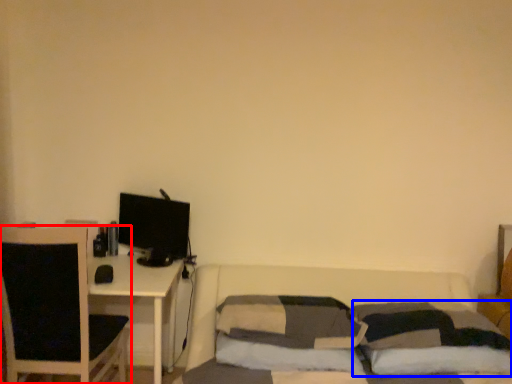
Question: Among these objects, which one is nearest to the camera, chair (highlighted by a red box) or pillow (highlighted by a blue box)?

Choices:
 (A) chair
 (B) pillow

Answer: (B)